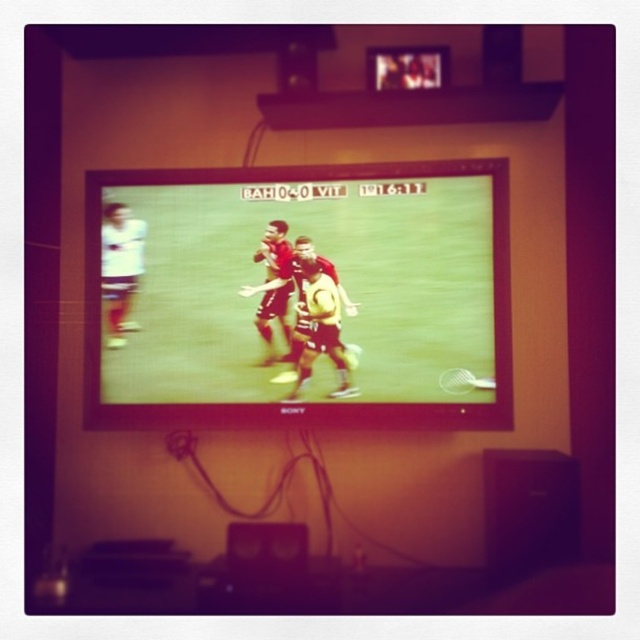
You are standing in a room with a television mounted on the wall. You notice a specific point on the wall at coordinates (x=300, y=294). Based on the scene description, what object is located at that point?

The point at coordinates (x=300, y=294) indicates the location of the matte plastic television at center.